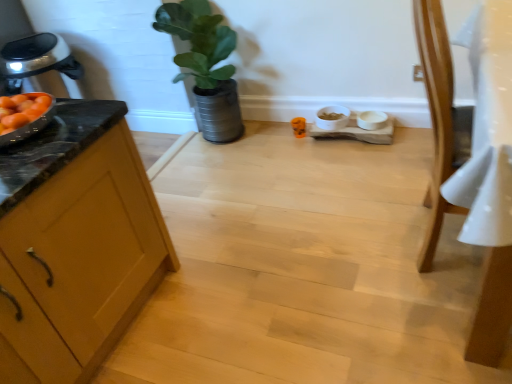
You are a GUI agent. You are given a task and a screenshot of the screen. Output one action in this format:
    pyautogui.click(x=<x>, y=<y>)
    Task: Click on the free location to the right of green matte plant at upper center
    Image resolution: width=512 pixels, height=384 pixels.
    Given the screenshot: What is the action you would take?
    point(276,137)